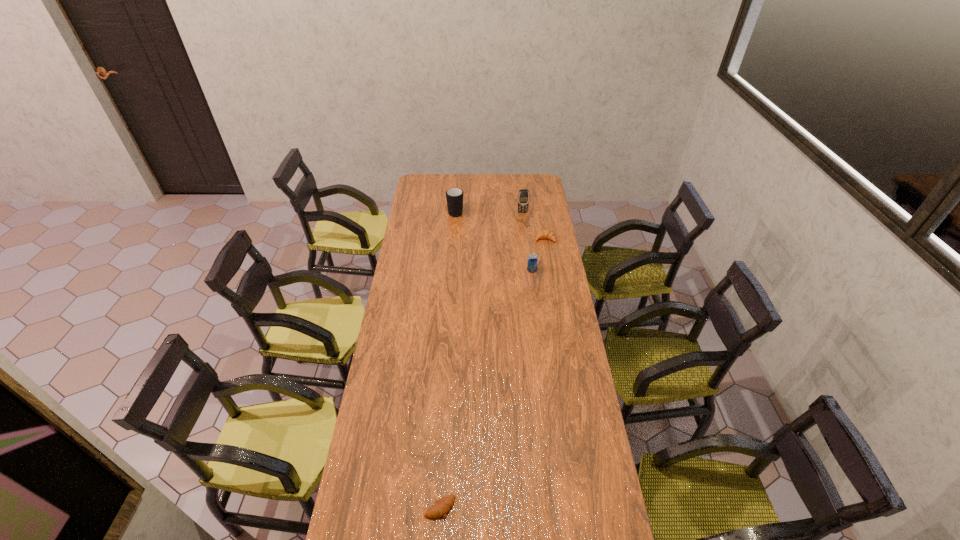
In the image, there is a desktop. Identify the location of free space at the right edge. (547, 370).

Find the location of a particular element. Image resolution: width=960 pixels, height=540 pixels. free spot between the mug and the cellular telephone is located at coordinates (489, 212).

This screenshot has width=960, height=540. I want to click on unoccupied area between the mug and the farther crescent roll, so click(x=500, y=225).

Identify the location of vacant point located between the beer can and the cellular telephone. (527, 241).

Locate an element on the screen. This screenshot has width=960, height=540. free space between the beer can and the shortest object is located at coordinates (486, 388).

The image size is (960, 540). I want to click on vacant area between the left crescent roll and the beer can, so click(486, 388).

At what (x,y) coordinates should I click in order to perform the action: click on vacant point located between the cellular telephone and the mug. Please return your answer as a coordinate pair (x, y). Looking at the image, I should click on (489, 212).

You are a GUI agent. You are given a task and a screenshot of the screen. Output one action in this format:
    pyautogui.click(x=<x>, y=<y>)
    Task: Click on the vacant area that lies between the second nearest object and the farther crescent roll
    
    Given the screenshot: What is the action you would take?
    pyautogui.click(x=539, y=255)

The height and width of the screenshot is (540, 960). I want to click on vacant area between the mug and the cellular telephone, so click(x=489, y=212).

At what (x,y) coordinates should I click in order to perform the action: click on object that ranks as the fourth closest to the mug. Please return your answer as a coordinate pair (x, y). The height and width of the screenshot is (540, 960). Looking at the image, I should click on (440, 507).